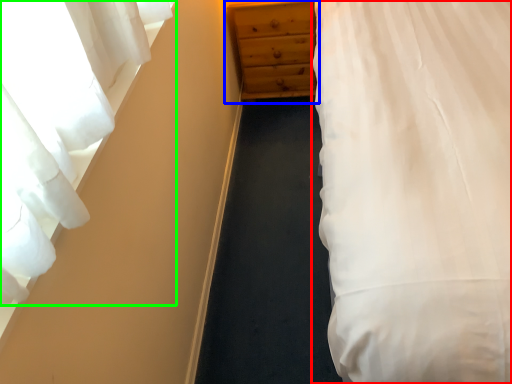
Question: Which is farther away from bed (highlighted by a red box)? chest of drawers (highlighted by a blue box) or curtain (highlighted by a green box)?

Choices:
 (A) chest of drawers
 (B) curtain

Answer: (A)